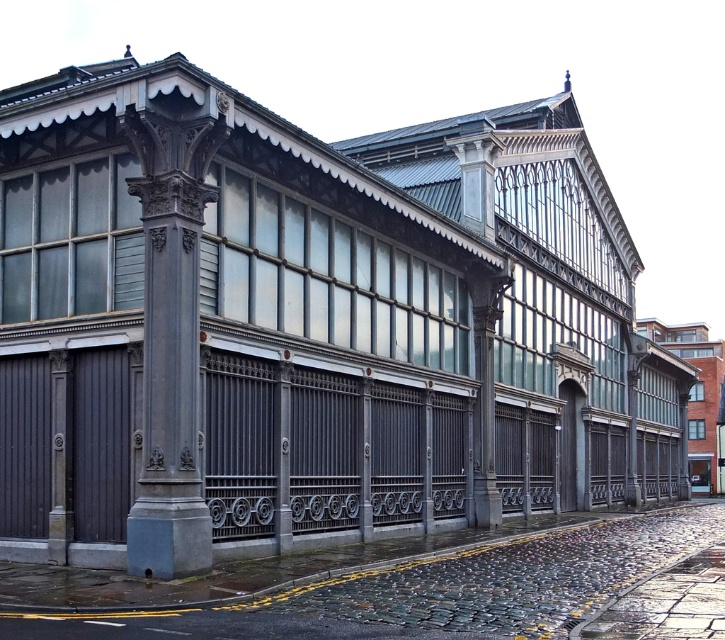
In the scene shown: You are standing in front of the historic Victorian building and want to walk from the slate gray stone column at left to the cobblestone pavement at lower center. Which direction should you move relative to the column?

You should move to the right relative to the slate gray stone column at left because the cobblestone pavement at lower center is positioned on the right side of it.

You are a delivery person approaching the historic building. You need to place a heavy box on the ground near the cobblestone pavement at lower center and the slate gray stone column at left. Which surface can better support the weight of the box?

The cobblestone pavement at lower center can better support the weight of the box because it is larger in size than the slate gray stone column at left.

You are a city planner assessing the space in front of the historic Victorian building. You need to install a new bench that is 1.8 meters wide. The bench must be placed either on the cobblestone pavement at lower center or next to the slate gray stone column at left. Which location has enough space to accommodate the bench without overlapping the column or pavement edges?

The cobblestone pavement at lower center has a larger width than the slate gray stone column at left, so the bench can be placed on the cobblestone pavement at lower center as it provides sufficient space for the 1.8 meter wide bench.